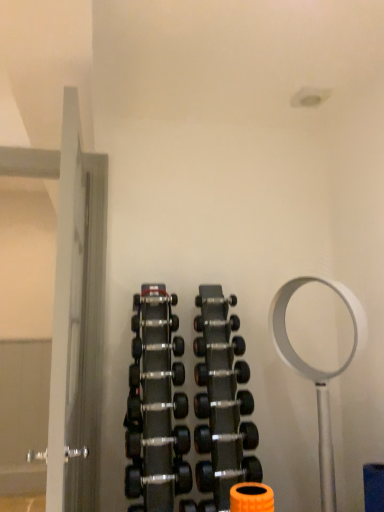
Question: From a real-world perspective, is black rubber dumbbell at center, acting as the ninth dumbbell starting from the top, positioned over black rubber dumbbell at center, marked as the sixth dumbbell in a bottom-to-top arrangement, based on gravity?

Choices:
 (A) no
 (B) yes

Answer: (A)

Question: Can you confirm if black rubber dumbbell at center, the third dumbbell when ordered from bottom to top, is bigger than black rubber dumbbell at center, which is the sixth dumbbell in top-to-bottom order?

Choices:
 (A) yes
 (B) no

Answer: (A)

Question: Can you confirm if black rubber dumbbell at center, the third dumbbell when ordered from bottom to top, is shorter than black rubber dumbbell at center, marked as the sixth dumbbell in a bottom-to-top arrangement?

Choices:
 (A) yes
 (B) no

Answer: (B)

Question: Is the depth of black rubber dumbbell at center, acting as the ninth dumbbell starting from the top, greater than that of black rubber dumbbell at center, marked as the sixth dumbbell in a bottom-to-top arrangement?

Choices:
 (A) no
 (B) yes

Answer: (B)

Question: From a real-world perspective, is black rubber dumbbell at center, acting as the ninth dumbbell starting from the top, physically below black rubber dumbbell at center, which is the sixth dumbbell in top-to-bottom order?

Choices:
 (A) no
 (B) yes

Answer: (B)

Question: Is black rubber dumbbell at center, arranged as the 4th dumbbell when ordered from the bottom, situated inside black rubber dumbbell at center, acting as the 5th dumbbell starting from the bottom, or outside?

Choices:
 (A) inside
 (B) outside

Answer: (B)

Question: From a real-world perspective, relative to black rubber dumbbell at center, acting as the 5th dumbbell starting from the bottom, is black rubber dumbbell at center, marked as the eighth dumbbell in a top-to-bottom arrangement, vertically above or below?

Choices:
 (A) above
 (B) below

Answer: (B)

Question: Does point (185, 443) appear closer or farther from the camera than point (208, 396)?

Choices:
 (A) farther
 (B) closer

Answer: (B)

Question: Visually, is black rubber dumbbell at center, arranged as the 4th dumbbell when ordered from the bottom, positioned to the left or to the right of black rubber dumbbell at center, arranged as the 7th dumbbell when viewed from the top?

Choices:
 (A) left
 (B) right

Answer: (A)

Question: Is black rubber dumbbell at center, the 11th dumbbell positioned from the top, inside or outside of black rubber dumbbell at center, the 3th dumbbell in the top-to-bottom sequence?

Choices:
 (A) outside
 (B) inside

Answer: (A)

Question: In the image, is black rubber dumbbell at center, the 11th dumbbell positioned from the top, on the left side or the right side of black rubber dumbbell at center, the 3th dumbbell in the top-to-bottom sequence?

Choices:
 (A) right
 (B) left

Answer: (A)

Question: From the image's perspective, is black rubber dumbbell at center, the 11th dumbbell positioned from the top, positioned above or below black rubber dumbbell at center, the ninth dumbbell from the bottom?

Choices:
 (A) above
 (B) below

Answer: (B)

Question: From their relative heights in the image, would you say black rubber dumbbell at center, the 11th dumbbell positioned from the top, is taller or shorter than black rubber dumbbell at center, the 3th dumbbell in the top-to-bottom sequence?

Choices:
 (A) tall
 (B) short

Answer: (A)

Question: From their relative heights in the image, would you say black rubber dumbbell at center, arranged as the 4th dumbbell when ordered from the bottom, is taller or shorter than black rubber dumbbell at center, the 10th dumbbell viewed from the top?

Choices:
 (A) short
 (B) tall

Answer: (A)

Question: Looking at the image, does black rubber dumbbell at center, arranged as the 4th dumbbell when ordered from the bottom, seem bigger or smaller compared to black rubber dumbbell at center, the 10th dumbbell viewed from the top?

Choices:
 (A) big
 (B) small

Answer: (B)